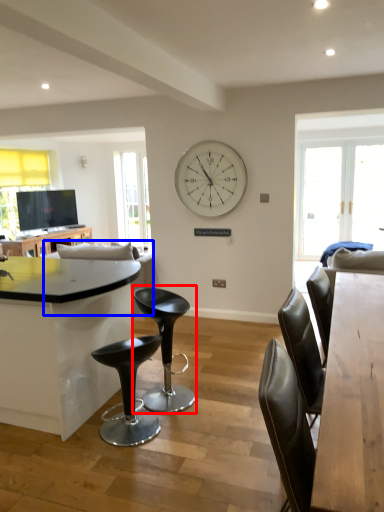
Question: Which point is closer to the camera, chair (highlighted by a red box) or couch (highlighted by a blue box)?

Choices:
 (A) chair
 (B) couch

Answer: (A)